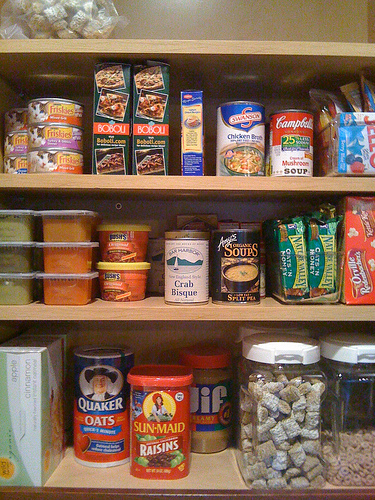
Locate an element on the screen. The image size is (375, 500). boxed items is located at coordinates (45, 418), (62, 332), (357, 228), (151, 125), (111, 120), (189, 124).